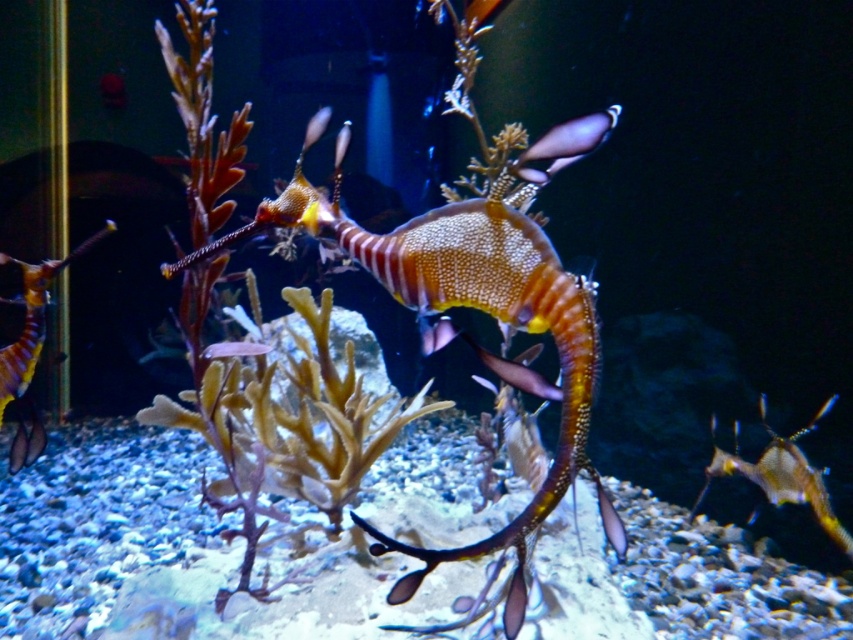
Question: Which of these objects is positioned farthest from the shiny metallic seahorse at center?

Choices:
 (A) shiny orange seahorse at left
 (B) shiny purple fish at upper center

Answer: (A)

Question: Does shiny orange seahorse at left appear on the left side of shiny metallic seahorse at center?

Choices:
 (A) no
 (B) yes

Answer: (B)

Question: Which of the following is the closest to the observer?

Choices:
 (A) shiny purple fish at upper center
 (B) shiny metallic seahorse at center
 (C) shiny orange seahorse at left

Answer: (A)

Question: Estimate the real-world distances between objects in this image. Which object is farther from the shiny metallic seahorse at center?

Choices:
 (A) shiny orange seahorse at left
 (B) shiny purple fish at upper center

Answer: (A)

Question: Is shiny metallic seahorse at center smaller than shiny purple fish at upper center?

Choices:
 (A) no
 (B) yes

Answer: (A)

Question: Is shiny orange seahorse at left to the left of shiny metallic seahorse at center from the viewer's perspective?

Choices:
 (A) no
 (B) yes

Answer: (B)